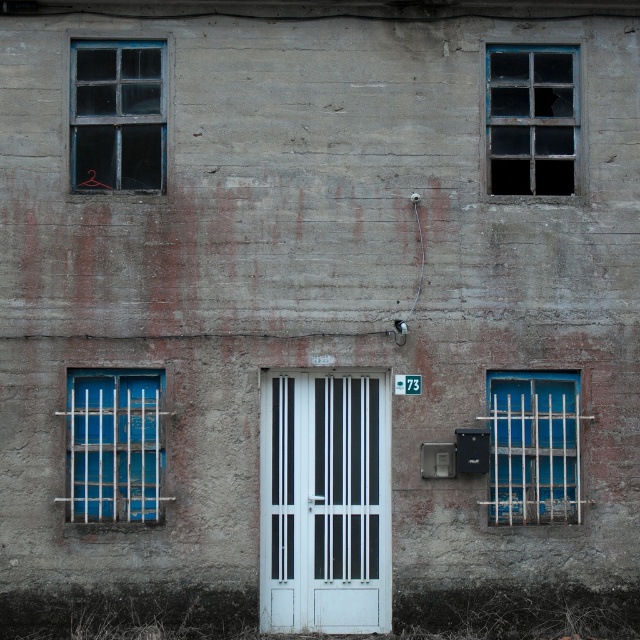
Question: Which is farther from the clear glass window at upper left?

Choices:
 (A) white glossy door at center
 (B) transparent glass window at upper right

Answer: (B)

Question: Which is nearer to the clear glass window at upper left?

Choices:
 (A) white glossy door at center
 (B) blue painted metal bars at right
 (C) transparent glass window at upper right
 (D) blue painted metal bars at lower left

Answer: (D)

Question: Can you confirm if white glossy door at center is positioned to the left of clear glass window at upper left?

Choices:
 (A) yes
 (B) no

Answer: (B)

Question: Is white glossy door at center behind blue painted metal bars at lower left?

Choices:
 (A) yes
 (B) no

Answer: (A)

Question: Is blue painted metal bars at lower left below blue painted metal bars at right?

Choices:
 (A) yes
 (B) no

Answer: (B)

Question: Which object is farther from the camera taking this photo?

Choices:
 (A) clear glass window at upper left
 (B) white glossy door at center

Answer: (A)